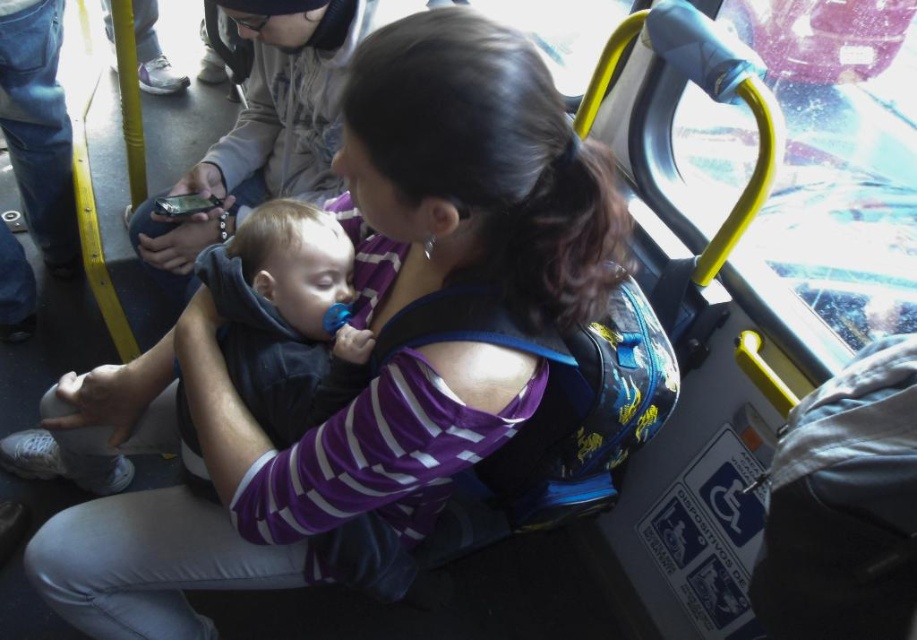
Question: Which point is closer to the camera taking this photo?

Choices:
 (A) (282, 304)
 (B) (111, 408)
 (C) (337, 184)

Answer: (A)

Question: Is purple striped shirt at center smaller than dark blue fleece at center?

Choices:
 (A) yes
 (B) no

Answer: (B)

Question: Is purple striped shirt at center smaller than dark blue fleece at center?

Choices:
 (A) no
 (B) yes

Answer: (A)

Question: Which object appears closest to the camera in this image?

Choices:
 (A) purple striped shirt at center
 (B) dark blue fleece at center

Answer: (A)

Question: Which of the following is the closest to the observer?

Choices:
 (A) (245, 19)
 (B) (312, 422)

Answer: (B)

Question: Does purple striped shirt at center lie in front of dark blue fleece at center?

Choices:
 (A) yes
 (B) no

Answer: (A)